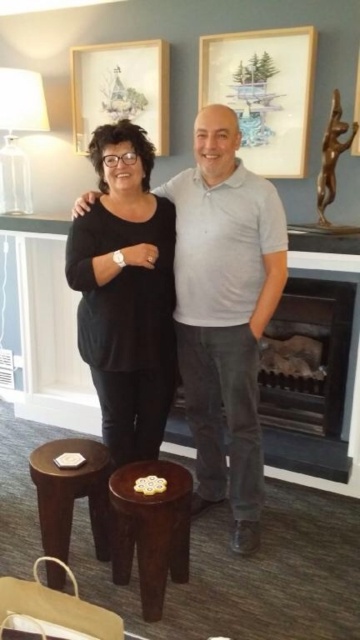
Question: Which of the following is the closest to the observer?

Choices:
 (A) (97, 99)
 (B) (114, 461)

Answer: (B)

Question: Which of these objects is positioned closest to the matte black shirt at center?

Choices:
 (A) matte wooden picture frame at upper center
 (B) black matte shirt at center

Answer: (B)

Question: Can you confirm if wooden picture frame at upper center is positioned to the right of matte wooden picture frame at upper center?

Choices:
 (A) yes
 (B) no

Answer: (A)

Question: Is dark brown wooden stool at center above matte wooden picture frame at upper center?

Choices:
 (A) no
 (B) yes

Answer: (A)

Question: Among these objects, which one is farthest from the camera?

Choices:
 (A) wooden picture frame at upper center
 (B) matte wooden picture frame at upper center
 (C) dark brown wood stool at lower left

Answer: (B)

Question: Is black matte shirt at center to the right of dark brown wood stool at lower left from the viewer's perspective?

Choices:
 (A) no
 (B) yes

Answer: (B)